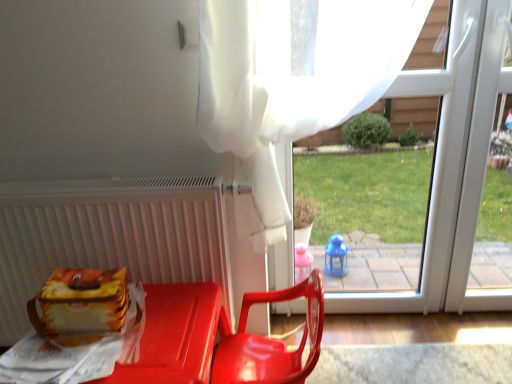
Measure the distance between transparent plastic window at center and camera.

transparent plastic window at center and camera are 1.24 meters apart from each other.

Image resolution: width=512 pixels, height=384 pixels. What do you see at coordinates (453, 165) in the screenshot?
I see `transparent plastic window at center` at bounding box center [453, 165].

The image size is (512, 384). Describe the element at coordinates (132, 343) in the screenshot. I see `matte plastic chair at lower center` at that location.

You are a GUI agent. You are given a task and a screenshot of the screen. Output one action in this format:
    pyautogui.click(x=<x>, y=<y>)
    Task: Click on the glossy plastic chair at center
    
    Given the screenshot: What is the action you would take?
    pyautogui.click(x=271, y=342)

The image size is (512, 384). Describe the element at coordinates (80, 305) in the screenshot. I see `matte plastic lunch box at lower left` at that location.

Identify the location of transparent plastic window at center. Image resolution: width=512 pixels, height=384 pixels. (453, 165).

Which is closer, (108, 363) or (154, 237)?

Point (108, 363) is positioned closer to the camera compared to point (154, 237).

Does matte plastic chair at lower center contain white matte radiator at left?

No, white matte radiator at left is not a part of matte plastic chair at lower center.

From the image's perspective, relative to white matte radiator at left, is matte plastic chair at lower center above or below?

matte plastic chair at lower center is situated lower than white matte radiator at left in the image.

Is matte plastic chair at lower center smaller than white matte radiator at left?

Incorrect, matte plastic chair at lower center is not smaller in size than white matte radiator at left.

Between matte plastic chair at lower center and glossy plastic chair at center, which one appears on the left side from the viewer's perspective?

matte plastic chair at lower center.

From the image's perspective, is matte plastic chair at lower center positioned above or below glossy plastic chair at center?

Based on their image positions, matte plastic chair at lower center is located beneath glossy plastic chair at center.

Is matte plastic chair at lower center bigger or smaller than glossy plastic chair at center?

In the image, matte plastic chair at lower center appears to be larger than glossy plastic chair at center.

Find the location of a particular element. furniture below the glossy plastic chair at center (from a real-world perspective) is located at coordinates (132, 343).

Based on the photo, does white matte radiator at left appear on the right side of glossy plastic chair at center?

In fact, white matte radiator at left is to the left of glossy plastic chair at center.

Is white matte radiator at left far from glossy plastic chair at center?

They are positioned close to each other.

Relative to glossy plastic chair at center, is white matte radiator at left in front or behind?

white matte radiator at left is positioned farther from the viewer than glossy plastic chair at center.

Considering the relative sizes of white matte radiator at left and glossy plastic chair at center in the image provided, is white matte radiator at left taller than glossy plastic chair at center?

Yes, white matte radiator at left is taller than glossy plastic chair at center.

Do you think transparent plastic window at center is within white matte radiator at left, or outside of it?

transparent plastic window at center lies outside white matte radiator at left.

Relative to white matte radiator at left, is transparent plastic window at center in front or behind?

transparent plastic window at center is behind white matte radiator at left.

Based on their sizes in the image, would you say transparent plastic window at center is bigger or smaller than white matte radiator at left?

In the image, transparent plastic window at center appears to be larger than white matte radiator at left.

Considering the positions of objects matte plastic lunch box at lower left and matte plastic chair at lower center in the image provided, who is in front, matte plastic lunch box at lower left or matte plastic chair at lower center?

matte plastic chair at lower center.

From the image's perspective, is matte plastic lunch box at lower left under matte plastic chair at lower center?

No, from the image's perspective, matte plastic lunch box at lower left is not below matte plastic chair at lower center.

Considering the relative positions of matte plastic lunch box at lower left and matte plastic chair at lower center in the image provided, is matte plastic lunch box at lower left to the left or to the right of matte plastic chair at lower center?

matte plastic lunch box at lower left is positioned on matte plastic chair at lower center's left side.

Is glossy plastic chair at center thinner than matte plastic lunch box at lower left?

Incorrect, the width of glossy plastic chair at center is not less than that of matte plastic lunch box at lower left.

Which object is closer to the camera taking this photo, glossy plastic chair at center or matte plastic lunch box at lower left?

glossy plastic chair at center.

Considering the sizes of glossy plastic chair at center and matte plastic lunch box at lower left in the image, is glossy plastic chair at center bigger or smaller than matte plastic lunch box at lower left?

In the image, glossy plastic chair at center appears to be larger than matte plastic lunch box at lower left.

Is glossy plastic chair at center at the left side of matte plastic lunch box at lower left?

In fact, glossy plastic chair at center is to the right of matte plastic lunch box at lower left.

From a real-world perspective, is white matte radiator at left physically located above or below transparent plastic window at center?

white matte radiator at left is situated lower than transparent plastic window at center in the real world.

Is white matte radiator at left wider or thinner than transparent plastic window at center?

white matte radiator at left is wider than transparent plastic window at center.

Between white matte radiator at left and transparent plastic window at center, which one has less height?

With less height is white matte radiator at left.

Is white matte radiator at left to the left or to the right of transparent plastic window at center in the image?

Based on their positions, white matte radiator at left is located to the left of transparent plastic window at center.

Image resolution: width=512 pixels, height=384 pixels. In order to click on furniture directly beneath the white matte radiator at left (from a real-world perspective) in this screenshot , I will do `click(132, 343)`.

Identify the location of furniture located behind the glossy plastic chair at center. This screenshot has width=512, height=384. (132, 343).

Considering their positions, is matte plastic chair at lower center positioned further to glossy plastic chair at center than white matte radiator at left?

white matte radiator at left.

Based on their spatial positions, is matte plastic lunch box at lower left or glossy plastic chair at center closer to transparent plastic window at center?

glossy plastic chair at center is positioned closer to the anchor transparent plastic window at center.

Considering their positions, is glossy plastic chair at center positioned further to matte plastic chair at lower center than transparent plastic window at center?

transparent plastic window at center.

Consider the image. Looking at the image, which one is located further to transparent plastic window at center, white matte radiator at left or matte plastic lunch box at lower left?

Among the two, matte plastic lunch box at lower left is located further to transparent plastic window at center.

When comparing their distances from matte plastic chair at lower center, does matte plastic lunch box at lower left or white matte radiator at left seem further?

white matte radiator at left is further to matte plastic chair at lower center.

When comparing their distances from white matte radiator at left, does transparent plastic window at center or matte plastic lunch box at lower left seem closer?

matte plastic lunch box at lower left is positioned closer to the anchor white matte radiator at left.

Looking at the image, which one is located further to matte plastic chair at lower center, white matte radiator at left or glossy plastic chair at center?

white matte radiator at left lies further to matte plastic chair at lower center than the other object.

Based on their spatial positions, is matte plastic chair at lower center or matte plastic lunch box at lower left closer to glossy plastic chair at center?

Based on the image, matte plastic chair at lower center appears to be nearer to glossy plastic chair at center.

At what (x,y) coordinates should I click in order to perform the action: click on lunch box between white matte radiator at left and matte plastic chair at lower center vertically. Please return your answer as a coordinate pair (x, y). The height and width of the screenshot is (384, 512). Looking at the image, I should click on (80, 305).

This screenshot has height=384, width=512. I want to click on furniture located between matte plastic lunch box at lower left and glossy plastic chair at center in the left-right direction, so click(x=132, y=343).

Identify the location of lunch box between white matte radiator at left and transparent plastic window at center. The width and height of the screenshot is (512, 384). (80, 305).

In order to click on lunch box between white matte radiator at left and glossy plastic chair at center in the horizontal direction in this screenshot , I will do `click(80, 305)`.